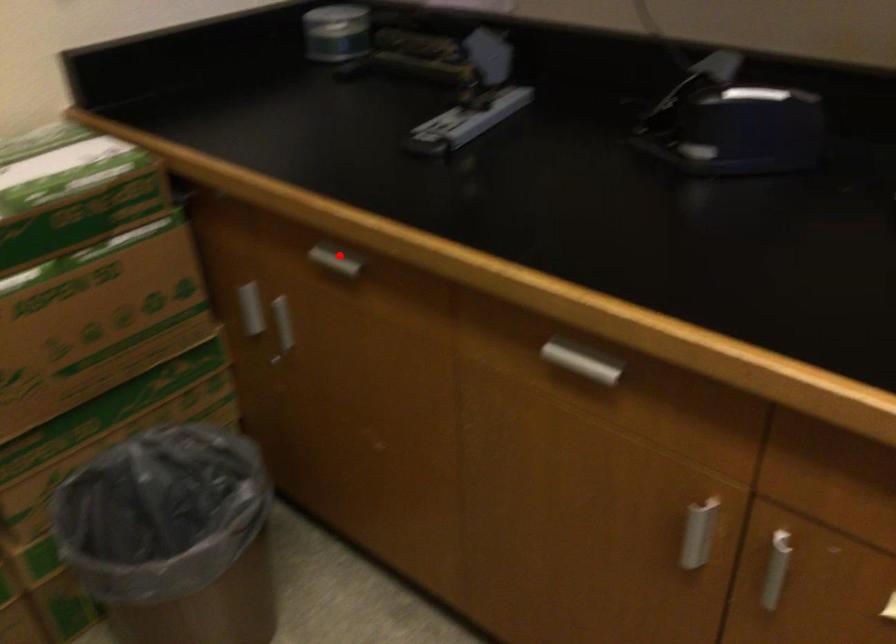
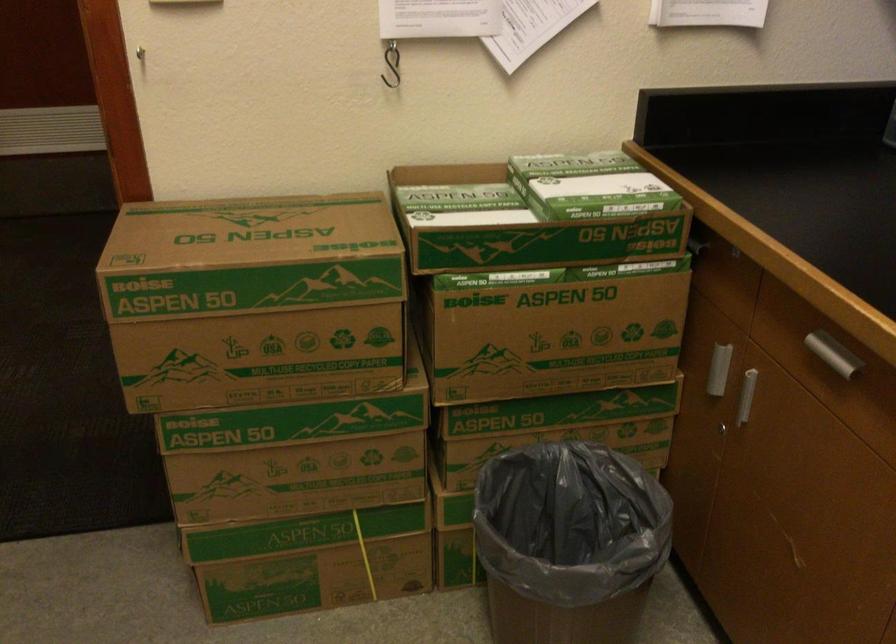
Find the pixel in the second image that matches the highlighted location in the first image.

(831, 353)